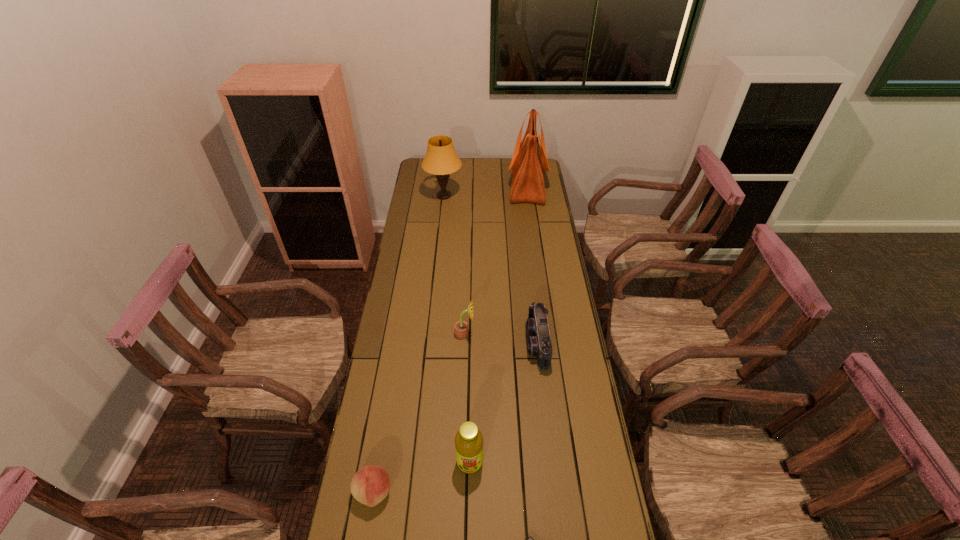
Locate an element on the screen. This screenshot has height=540, width=960. shopping bag is located at coordinates (529, 161).

Identify the location of lampshade. (441, 159).

The height and width of the screenshot is (540, 960). I want to click on fruit juice, so click(x=468, y=441).

What are the coordinates of `sunflower` in the screenshot? It's located at (461, 327).

Find the location of a particular element. The image size is (960, 540). the fifth tallest object is located at coordinates (539, 344).

Where is `the second shortest object`? The height and width of the screenshot is (540, 960). the second shortest object is located at coordinates tap(370, 485).

This screenshot has height=540, width=960. What are the coordinates of `vacant space situated 0.240m on the left of the shopping bag` in the screenshot? It's located at (465, 186).

Where is `free spot located on the back of the lampshade`? This screenshot has width=960, height=540. free spot located on the back of the lampshade is located at coordinates (446, 167).

The height and width of the screenshot is (540, 960). Identify the location of vacant space located on the front label of the fruit juice. (468, 515).

This screenshot has height=540, width=960. I want to click on free spot located on the face of the sunflower, so click(x=552, y=334).